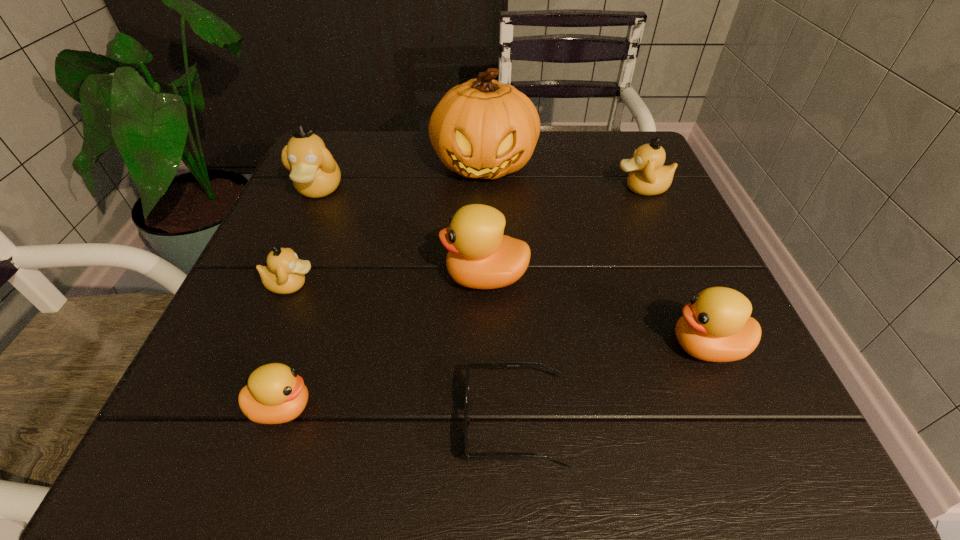
Find the location of a particular element. This screenshot has width=960, height=540. the third closest duckling to the second biggest tan duckling is located at coordinates (314, 172).

Choose which tan duckling is the nearest neighbor to the third duckling from right to left. Please provide its 2D coordinates. Your answer should be formatted as a tuple, i.e. [(x, y)], where the tuple contains the x and y coordinates of a point satisfying the conditions above.

[(284, 274)]

Select which tan duckling appears as the third closest to the nearest duckling. Please provide its 2D coordinates. Your answer should be formatted as a tuple, i.e. [(x, y)], where the tuple contains the x and y coordinates of a point satisfying the conditions above.

[(648, 176)]

Locate which yellow duckling is the second closest to the pumpkin. Please provide its 2D coordinates. Your answer should be formatted as a tuple, i.e. [(x, y)], where the tuple contains the x and y coordinates of a point satisfying the conditions above.

[(716, 326)]

Find the location of `yellow duckling that stands as the third closest to the pumpkin`. yellow duckling that stands as the third closest to the pumpkin is located at coordinates (275, 394).

Identify the location of blank area in the image that satisfies the following two spatial constraints: 1. on the face of the second biggest tan duckling; 2. on the face of the biggest tan duckling. (642, 190).

Identify the location of vacant space that satisfies the following two spatial constraints: 1. on the front face of the pumpkin; 2. on the face of the third duckling from right to left. This screenshot has height=540, width=960. (486, 277).

What are the coordinates of `free space in the image that satisfies the following two spatial constraints: 1. on the front face of the tallest object; 2. on the face of the leftmost yellow duckling` in the screenshot? It's located at (488, 408).